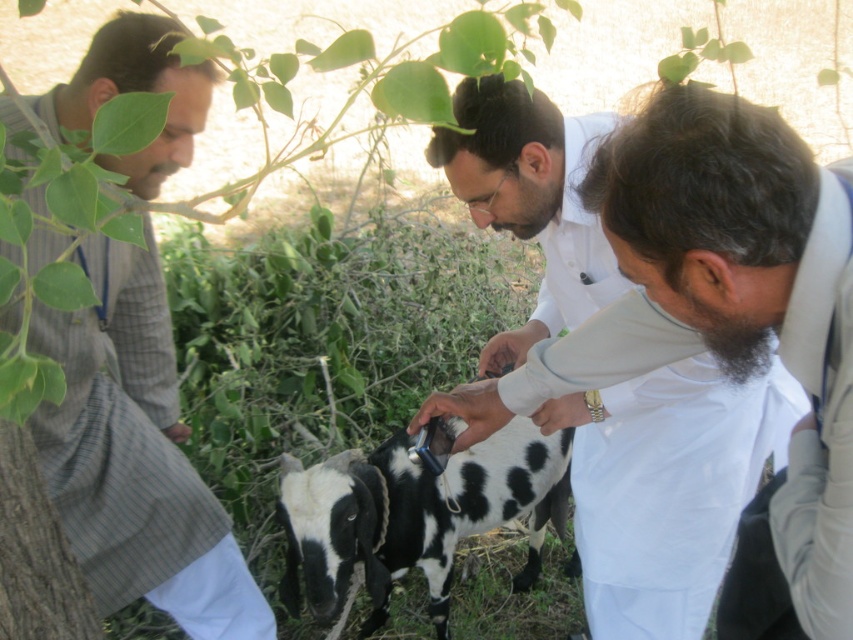
You are a photographer standing at the edge of the scene. You want to take a photo that includes both the green leafy tree at upper left and the white shirt at center. Given that your camera has a maximum focus range of 60 centimeters, will you be able to capture both objects in focus without adjusting your position?

The green leafy tree at upper left and white shirt at center are 66.08 centimeters apart from each other. Since the distance between them exceeds the camera maximum focus range of 60 centimeters, you will need to adjust your position to ensure both are within the focus range.

You are standing in the rural area shown in the image. If you want to move from the green leafy tree at upper left to the black and white spotted goat at center, which direction should you move towards?

Since the green leafy tree at upper left is closer to the viewer than the black and white spotted goat at center, you would need to move forward towards the center of the image to reach the goat.

You are a photographer trying to capture a photo of the black and white spotted goat at center. To ensure the striped fabric shirt at left doesn not block the view, which direction should you move the camera?

Move the camera to the right so that the striped fabric shirt at left is no longer blocking the view of the black and white spotted goat at center.